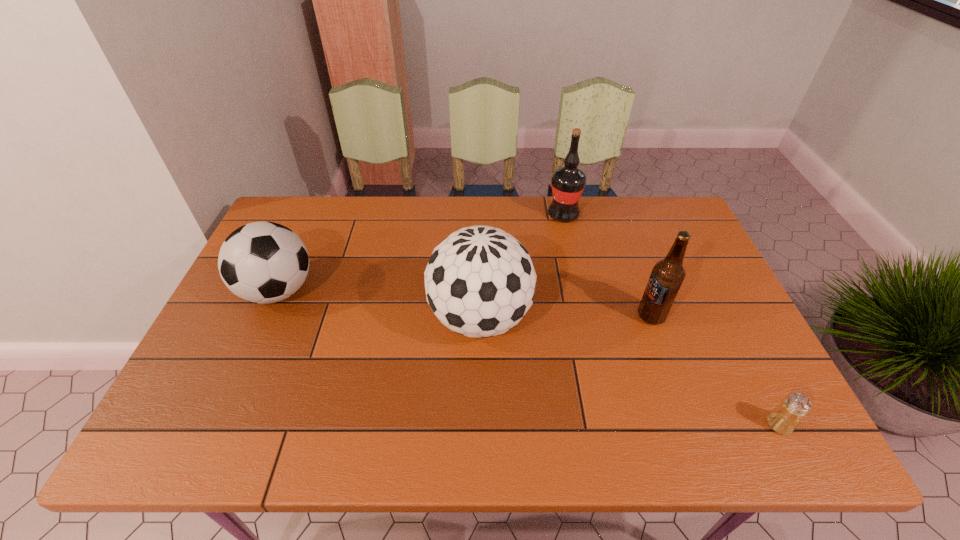
Image resolution: width=960 pixels, height=540 pixels. Find the location of `object that is at the near right corner`. object that is at the near right corner is located at coordinates (x=784, y=419).

In the image, there is a desktop. Find the location of `free region at the far edge`. free region at the far edge is located at coordinates (405, 216).

Image resolution: width=960 pixels, height=540 pixels. In the image, there is a desktop. Identify the location of vacant space at the near edge. (494, 430).

The image size is (960, 540). What are the coordinates of `free space at the left edge of the desktop` in the screenshot? It's located at (224, 330).

This screenshot has height=540, width=960. In order to click on vacant space at the right edge of the desktop in this screenshot , I will do `click(690, 295)`.

Find the location of `vacant space at the near right corner of the desktop`. vacant space at the near right corner of the desktop is located at coordinates (749, 434).

Image resolution: width=960 pixels, height=540 pixels. What are the coordinates of `unoccupied area between the second object from left to right and the beer bottle` in the screenshot? It's located at (565, 317).

You are a GUI agent. You are given a task and a screenshot of the screen. Output one action in this format:
    pyautogui.click(x=<x>, y=<y>)
    Task: Click on the vacant space that is in between the fourth object from right to left and the fourth object from left to right
    
    Given the screenshot: What is the action you would take?
    pyautogui.click(x=565, y=317)

The width and height of the screenshot is (960, 540). I want to click on vacant point located between the beer bottle and the rightmost object, so 715,370.

Image resolution: width=960 pixels, height=540 pixels. I want to click on unoccupied area between the fourth object from left to right and the right soccer ball, so click(x=565, y=317).